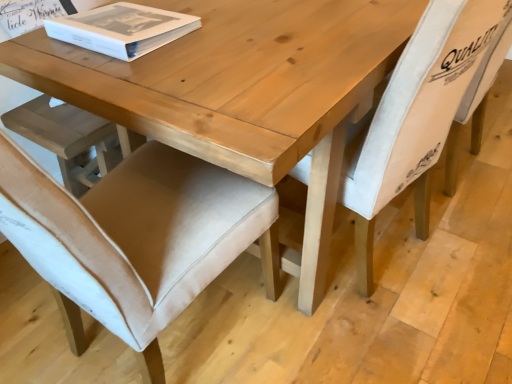
Question: From the image's perspective, is beige fabric chair at lower left, marked as the 1th chair in a left-to-right arrangement, located above white paper book at upper left?

Choices:
 (A) no
 (B) yes

Answer: (A)

Question: Considering the relative sizes of beige fabric chair at lower left, marked as the 1th chair in a left-to-right arrangement, and white paper book at upper left in the image provided, is beige fabric chair at lower left, marked as the 1th chair in a left-to-right arrangement, taller than white paper book at upper left?

Choices:
 (A) yes
 (B) no

Answer: (A)

Question: Is beige fabric chair at lower left, the second chair viewed from the right, with white paper book at upper left?

Choices:
 (A) yes
 (B) no

Answer: (B)

Question: Is beige fabric chair at lower left, marked as the 1th chair in a left-to-right arrangement, closer to the viewer compared to white paper book at upper left?

Choices:
 (A) no
 (B) yes

Answer: (B)

Question: Does beige fabric chair at lower left, the second chair viewed from the right, have a lesser width compared to white paper book at upper left?

Choices:
 (A) no
 (B) yes

Answer: (A)

Question: Can you confirm if beige fabric chair at lower left, the second chair viewed from the right, is wider than white paper book at upper left?

Choices:
 (A) no
 (B) yes

Answer: (B)

Question: Are light beige fabric chair at center, which is the second chair from left to right, and beige fabric chair at lower left, the second chair viewed from the right, far apart?

Choices:
 (A) yes
 (B) no

Answer: (B)

Question: From the image's perspective, is light beige fabric chair at center, which is the second chair from left to right, on top of beige fabric chair at lower left, marked as the 1th chair in a left-to-right arrangement?

Choices:
 (A) no
 (B) yes

Answer: (B)

Question: Can you confirm if light beige fabric chair at center, which is the second chair from left to right, is shorter than beige fabric chair at lower left, the second chair viewed from the right?

Choices:
 (A) yes
 (B) no

Answer: (A)

Question: Is light beige fabric chair at center, which is the second chair from left to right, wider than beige fabric chair at lower left, the second chair viewed from the right?

Choices:
 (A) yes
 (B) no

Answer: (B)

Question: Does light beige fabric chair at center, which is the second chair from left to right, have a larger size compared to beige fabric chair at lower left, marked as the 1th chair in a left-to-right arrangement?

Choices:
 (A) yes
 (B) no

Answer: (B)

Question: Is light beige fabric chair at center, the first chair in the right-to-left sequence, positioned before beige fabric chair at lower left, the second chair viewed from the right?

Choices:
 (A) yes
 (B) no

Answer: (B)

Question: From a real-world perspective, is beige fabric chair at lower left, the second chair viewed from the right, physically below light beige fabric chair at center, the first chair in the right-to-left sequence?

Choices:
 (A) yes
 (B) no

Answer: (A)